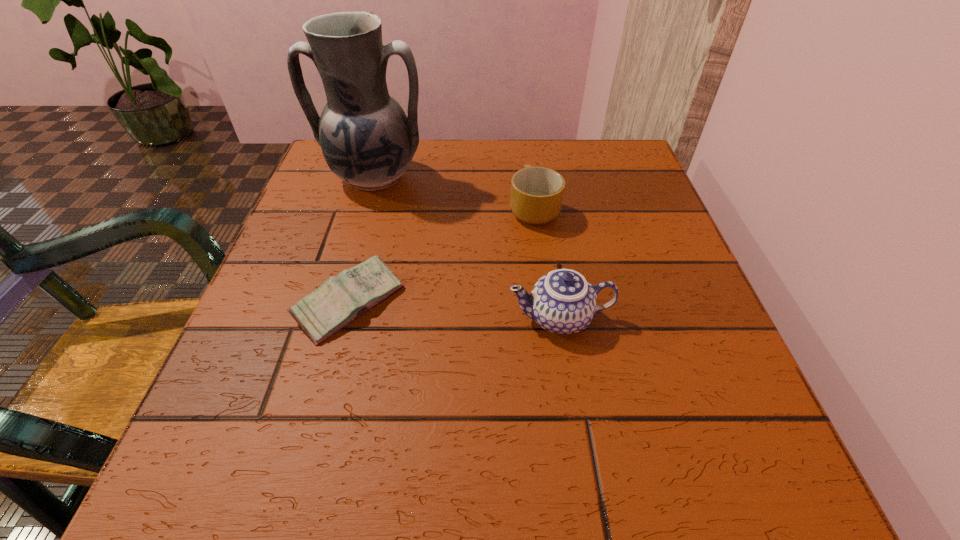
At what (x,y) coordinates should I click in order to perform the action: click on vacant region located 0.120m on the side with the handle of the mug. Please return your answer as a coordinate pair (x, y). Image resolution: width=960 pixels, height=540 pixels. Looking at the image, I should click on (527, 159).

Where is `free space located 0.150m on the front of the shortest object`? The height and width of the screenshot is (540, 960). free space located 0.150m on the front of the shortest object is located at coordinates (312, 444).

Locate an element on the screen. The width and height of the screenshot is (960, 540). pitcher that is at the far edge is located at coordinates tap(367, 140).

Locate an element on the screen. Image resolution: width=960 pixels, height=540 pixels. mug at the far edge is located at coordinates (536, 196).

I want to click on pitcher that is at the left edge, so click(x=367, y=140).

The image size is (960, 540). Find the location of `diary present at the left edge`. diary present at the left edge is located at coordinates (341, 299).

What are the coordinates of `object present at the right edge` in the screenshot? It's located at (562, 302).

Identify the location of object that is at the far left corner. The image size is (960, 540). (367, 140).

In the image, there is a desktop. Where is `vacant area at the far edge`? This screenshot has width=960, height=540. vacant area at the far edge is located at coordinates (490, 150).

The image size is (960, 540). In order to click on vacant space at the near edge in this screenshot , I will do `click(539, 503)`.